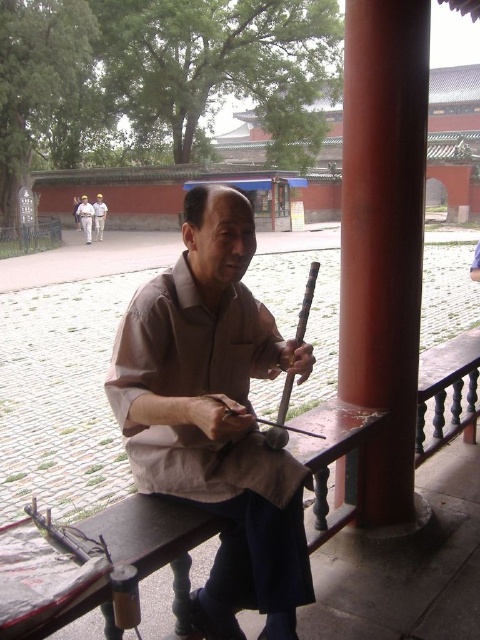
From the picture: You are a visitor at this historical site and want to take a photo of the brown matte shirt at center and the smooth red wood at center. Which object should you focus on first to ensure both are in the frame?

You should focus on the brown matte shirt at center first since it is in front of the smooth red wood at center, ensuring both are visible in the frame.

You are standing in a historical site and want to take a photo of the point marked at coordinates (421, 136). If your camera has a maximum focus range of 3 meters, will you be able to capture the point clearly?

The point at coordinates (421, 136) is 2.57 meters away from the camera, which is within the maximum focus range of 3 meters. Therefore, you can capture the point clearly.

You are an architect designing a new cultural center. You want to place a statue of the elderly man playing his instrument in such a way that the statue of the smooth red wood at center is visible above the statue of the brown cotton shirt at center. Is this possible based on the original scene?

Yes, because the smooth red wood at center has a greater height compared to the brown cotton shirt at center, so positioning the statue of the smooth red wood at center higher up would allow it to be visible above the brown cotton shirt at center.